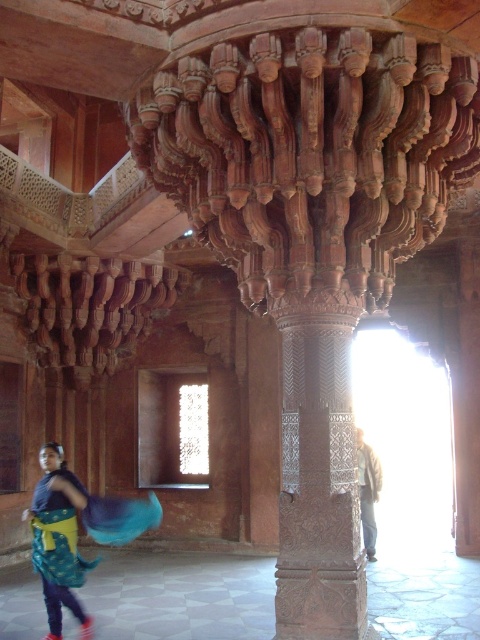
Does brown carved column at center have a smaller size compared to teal fabric skirt at lower left?

No.

Which is below, brown carved column at center or teal fabric skirt at lower left?

teal fabric skirt at lower left is lower down.

Image resolution: width=480 pixels, height=640 pixels. I want to click on brown carved column at center, so click(x=317, y=472).

Locate an element on the screen. This screenshot has width=480, height=640. brown carved column at center is located at coordinates (317, 472).

Where is `brown carved column at center`? brown carved column at center is located at coordinates (317, 472).

The width and height of the screenshot is (480, 640). In order to click on brown carved column at center in this screenshot , I will do `click(317, 472)`.

From the picture: Does teal fabric skirt at lower left have a lesser height compared to light brown leather jacket at right?

No.

Which is behind, point (50, 502) or point (380, 472)?

Positioned behind is point (380, 472).

Between point (48, 636) and point (380, 488), which one is positioned in front?

Positioned in front is point (48, 636).

The image size is (480, 640). I want to click on teal fabric skirt at lower left, so click(x=58, y=538).